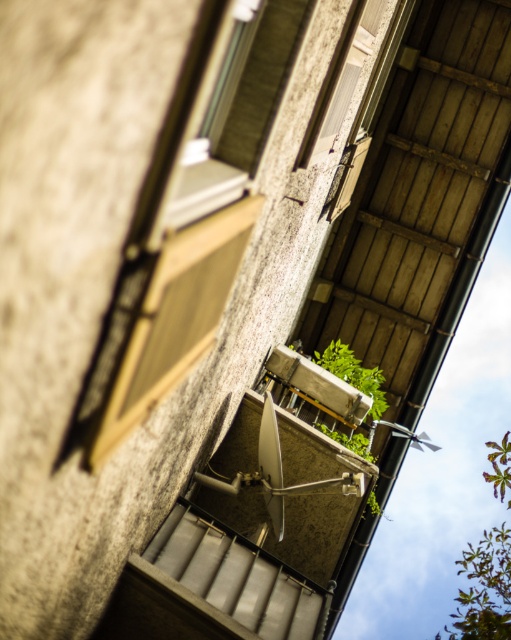
Is green leafy plant at lower right below green leafy plant at center?

Indeed, green leafy plant at lower right is positioned under green leafy plant at center.

Does green leafy plant at lower right have a lesser height compared to green leafy plant at center?

Incorrect, green leafy plant at lower right's height does not fall short of green leafy plant at center's.

Locate an element on the screen. This screenshot has height=640, width=511. green leafy plant at lower right is located at coordinates (484, 589).

Where is `green leafy plant at lower right`? green leafy plant at lower right is located at coordinates (484, 589).

Can you confirm if wooden window frame at upper center is bigger than green leafy plant at center?

Indeed, wooden window frame at upper center has a larger size compared to green leafy plant at center.

Who is taller, wooden window frame at upper center or green leafy plant at center?

Standing taller between the two is wooden window frame at upper center.

Does point (378, 22) lie behind point (328, 369)?

No, (378, 22) is in front of (328, 369).

Identify the location of wooden window frame at upper center. (341, 77).

How much distance is there between green leafy plant at lower right and wooden window frame at upper center?

green leafy plant at lower right is 9.13 meters away from wooden window frame at upper center.

Who is taller, green leafy plant at lower right or wooden window frame at upper center?

With more height is green leafy plant at lower right.

Looking at this image, who is more forward, (476, 560) or (355, 33)?

Point (355, 33)

Identify the location of green leafy plant at lower right. The width and height of the screenshot is (511, 640). [x=484, y=589].